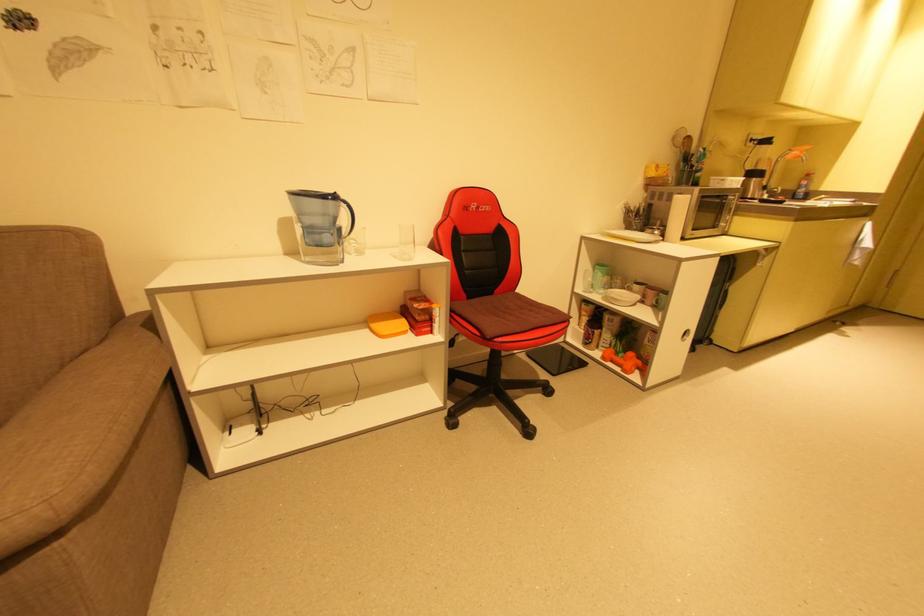
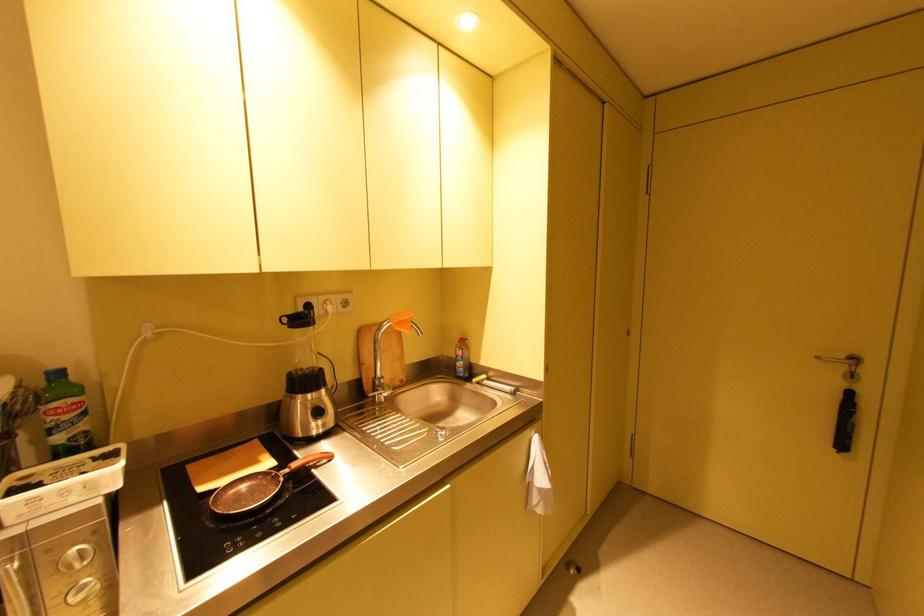
Where in the second image is the point corresponding to point 805,152 from the first image?

(400, 325)